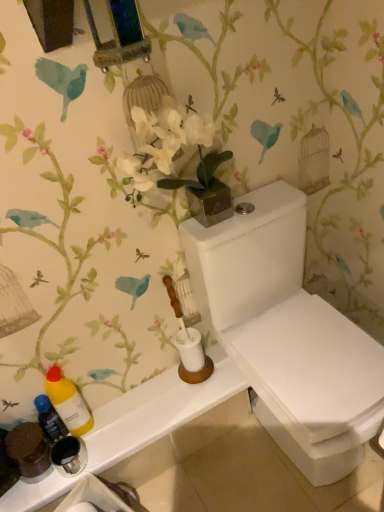
What is the approximate width of yellow matte bottle at lower left, the 1th bottle from the right?

It is 3.27 inches.

Identify the location of translucent plastic bottle at lower left, positioned as the 1th bottle in left-to-right order. The height and width of the screenshot is (512, 384). (49, 419).

This screenshot has height=512, width=384. What do you see at coordinates (49, 419) in the screenshot?
I see `translucent plastic bottle at lower left, positioned as the 1th bottle in left-to-right order` at bounding box center [49, 419].

In order to click on white glossy counter top at lower left in this screenshot , I will do `click(157, 410)`.

Where is `white ceramic toilet brush at center`? The height and width of the screenshot is (512, 384). white ceramic toilet brush at center is located at coordinates (188, 345).

I want to click on yellow matte bottle at lower left, the 1th bottle from the right, so click(x=68, y=402).

Considering the sizes of white glossy counter top at lower left and translucent plastic bottle at lower left, which is counted as the second bottle, starting from the right, in the image, is white glossy counter top at lower left wider or thinner than translucent plastic bottle at lower left, which is counted as the second bottle, starting from the right,?

white glossy counter top at lower left is wider than translucent plastic bottle at lower left, which is counted as the second bottle, starting from the right.

Between white glossy counter top at lower left and translucent plastic bottle at lower left, positioned as the 1th bottle in left-to-right order, which one has larger size?

With larger size is white glossy counter top at lower left.

Which of these two, white glossy counter top at lower left or translucent plastic bottle at lower left, which is counted as the second bottle, starting from the right, stands taller?

translucent plastic bottle at lower left, which is counted as the second bottle, starting from the right, is taller.

The width and height of the screenshot is (384, 512). I want to click on counter top located in front of the translucent plastic bottle at lower left, positioned as the 1th bottle in left-to-right order, so click(157, 410).

From the image's perspective, would you say white glossy counter top at lower left is shown under white glossy toilet at center?

Yes.

Consider the image. Is white glossy toilet at center surrounded by white glossy counter top at lower left?

That's incorrect, white glossy toilet at center is not inside white glossy counter top at lower left.

Can you confirm if white glossy counter top at lower left is taller than white glossy toilet at center?

In fact, white glossy counter top at lower left may be shorter than white glossy toilet at center.

Is yellow matte bottle at lower left, the 1th bottle from the right, not close to translucent plastic bottle at lower left, positioned as the 1th bottle in left-to-right order?

No, yellow matte bottle at lower left, the 1th bottle from the right, is not far from translucent plastic bottle at lower left, positioned as the 1th bottle in left-to-right order.

Where is `bottle in front of the translucent plastic bottle at lower left, positioned as the 1th bottle in left-to-right order`? This screenshot has width=384, height=512. bottle in front of the translucent plastic bottle at lower left, positioned as the 1th bottle in left-to-right order is located at coordinates (68, 402).

Looking at their sizes, would you say yellow matte bottle at lower left, which is the second bottle from left to right, is wider or thinner than translucent plastic bottle at lower left, positioned as the 1th bottle in left-to-right order?

Considering their sizes, yellow matte bottle at lower left, which is the second bottle from left to right, looks broader than translucent plastic bottle at lower left, positioned as the 1th bottle in left-to-right order.

Is yellow matte bottle at lower left, the 1th bottle from the right, taller or shorter than translucent plastic bottle at lower left, positioned as the 1th bottle in left-to-right order?

Clearly, yellow matte bottle at lower left, the 1th bottle from the right, is taller compared to translucent plastic bottle at lower left, positioned as the 1th bottle in left-to-right order.

Is white glossy toilet at center positioned far away from white glossy counter top at lower left?

That's not correct — white glossy toilet at center is a little close to white glossy counter top at lower left.

Which point is more distant from viewer, (296, 257) or (132, 406)?

The point (132, 406) is more distant.

Where is `toilet located above the white glossy counter top at lower left (from a real-world perspective)`? Image resolution: width=384 pixels, height=512 pixels. toilet located above the white glossy counter top at lower left (from a real-world perspective) is located at coordinates (287, 334).

Is white glossy counter top at lower left positioned behind white ceramic toilet brush at center?

Yes, white glossy counter top at lower left is behind white ceramic toilet brush at center.

From a real-world perspective, between white glossy counter top at lower left and white ceramic toilet brush at center, who is vertically lower?

white glossy counter top at lower left.

Identify the location of toiletries located on the right of white glossy counter top at lower left. (188, 345).

Looking at this image, could you tell me if white glossy counter top at lower left is facing white ceramic toilet brush at center?

No.

Identify the location of toilet in front of the translucent plastic bottle at lower left, which is counted as the second bottle, starting from the right. This screenshot has height=512, width=384. (287, 334).

Is there a large distance between white glossy toilet at center and translucent plastic bottle at lower left, which is counted as the second bottle, starting from the right?

No.

From the image's perspective, is white glossy toilet at center located above or below translucent plastic bottle at lower left, positioned as the 1th bottle in left-to-right order?

white glossy toilet at center is above translucent plastic bottle at lower left, positioned as the 1th bottle in left-to-right order.

Can you confirm if white glossy toilet at center is smaller than translucent plastic bottle at lower left, positioned as the 1th bottle in left-to-right order?

Actually, white glossy toilet at center might be larger than translucent plastic bottle at lower left, positioned as the 1th bottle in left-to-right order.

Is point (53, 410) farther from viewer compared to point (98, 455)?

Yes, point (53, 410) is behind point (98, 455).

Which object is wider, translucent plastic bottle at lower left, positioned as the 1th bottle in left-to-right order, or white glossy counter top at lower left?

white glossy counter top at lower left is wider.

Considering the relative positions of translucent plastic bottle at lower left, positioned as the 1th bottle in left-to-right order, and white glossy counter top at lower left in the image provided, is translucent plastic bottle at lower left, positioned as the 1th bottle in left-to-right order, to the left or to the right of white glossy counter top at lower left?

translucent plastic bottle at lower left, positioned as the 1th bottle in left-to-right order, is to the left of white glossy counter top at lower left.

Which object is closer to the camera, translucent plastic bottle at lower left, which is counted as the second bottle, starting from the right, or white glossy counter top at lower left?

white glossy counter top at lower left is more forward.

Identify the location of the 2nd bottle behind the white glossy counter top at lower left. (49, 419).

What are the coordinates of `toilet that is in front of the white glossy counter top at lower left` in the screenshot? It's located at (287, 334).

Estimate the real-world distances between objects in this image. Which object is further from white glossy toilet at center, translucent plastic bottle at lower left, which is counted as the second bottle, starting from the right, or white glossy counter top at lower left?

translucent plastic bottle at lower left, which is counted as the second bottle, starting from the right.

When comparing their distances from yellow matte bottle at lower left, the 1th bottle from the right, does translucent plastic bottle at lower left, which is counted as the second bottle, starting from the right, or white glossy toilet at center seem further?

white glossy toilet at center is positioned further to the anchor yellow matte bottle at lower left, the 1th bottle from the right.

Considering their positions, is white glossy toilet at center positioned further to translucent plastic bottle at lower left, positioned as the 1th bottle in left-to-right order, than yellow matte bottle at lower left, which is the second bottle from left to right?

Among the two, white glossy toilet at center is located further to translucent plastic bottle at lower left, positioned as the 1th bottle in left-to-right order.

Looking at the image, which one is located further to white ceramic toilet brush at center, white glossy toilet at center or yellow matte bottle at lower left, the 1th bottle from the right?

yellow matte bottle at lower left, the 1th bottle from the right.

Based on their spatial positions, is white ceramic toilet brush at center or white glossy counter top at lower left closer to white glossy toilet at center?

white ceramic toilet brush at center lies closer to white glossy toilet at center than the other object.

Looking at the image, which one is located closer to white glossy counter top at lower left, yellow matte bottle at lower left, the 1th bottle from the right, or white glossy toilet at center?

The object closer to white glossy counter top at lower left is yellow matte bottle at lower left, the 1th bottle from the right.

Which object lies further to the anchor point yellow matte bottle at lower left, which is the second bottle from left to right, white glossy toilet at center or translucent plastic bottle at lower left, positioned as the 1th bottle in left-to-right order?

Among the two, white glossy toilet at center is located further to yellow matte bottle at lower left, which is the second bottle from left to right.

Considering their positions, is translucent plastic bottle at lower left, positioned as the 1th bottle in left-to-right order, positioned closer to white ceramic toilet brush at center than yellow matte bottle at lower left, the 1th bottle from the right?

yellow matte bottle at lower left, the 1th bottle from the right.

The width and height of the screenshot is (384, 512). Find the location of `toiletries between yellow matte bottle at lower left, which is the second bottle from left to right, and white glossy toilet at center from left to right`. toiletries between yellow matte bottle at lower left, which is the second bottle from left to right, and white glossy toilet at center from left to right is located at coordinates (188, 345).

You are a GUI agent. You are given a task and a screenshot of the screen. Output one action in this format:
    pyautogui.click(x=<x>, y=<y>)
    Task: Click on the counter top between translucent plastic bottle at lower left, which is counted as the second bottle, starting from the right, and white ceramic toilet brush at center, in the horizontal direction
    
    Given the screenshot: What is the action you would take?
    pyautogui.click(x=157, y=410)

You are a GUI agent. You are given a task and a screenshot of the screen. Output one action in this format:
    pyautogui.click(x=<x>, y=<y>)
    Task: Click on the counter top between translucent plastic bottle at lower left, positioned as the 1th bottle in left-to-right order, and white glossy toilet at center from left to right
    Image resolution: width=384 pixels, height=512 pixels.
    Given the screenshot: What is the action you would take?
    pyautogui.click(x=157, y=410)

At what (x,y) coordinates should I click in order to perform the action: click on counter top between yellow matte bottle at lower left, the 1th bottle from the right, and white glossy toilet at center, in the horizontal direction. Please return your answer as a coordinate pair (x, y). The width and height of the screenshot is (384, 512). Looking at the image, I should click on (157, 410).